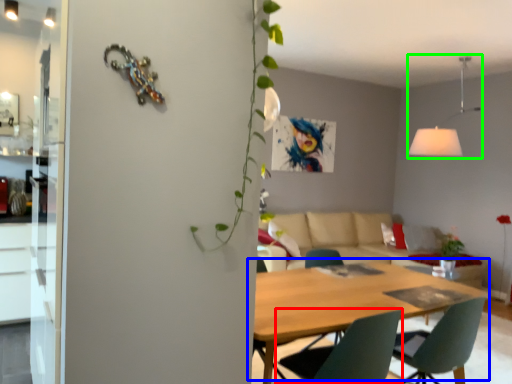
Question: Which object is positioned closest to chair (highlighted by a red box)? Select from kitchen & dining room table (highlighted by a blue box) and light fixture (highlighted by a green box).

Choices:
 (A) kitchen & dining room table
 (B) light fixture

Answer: (A)